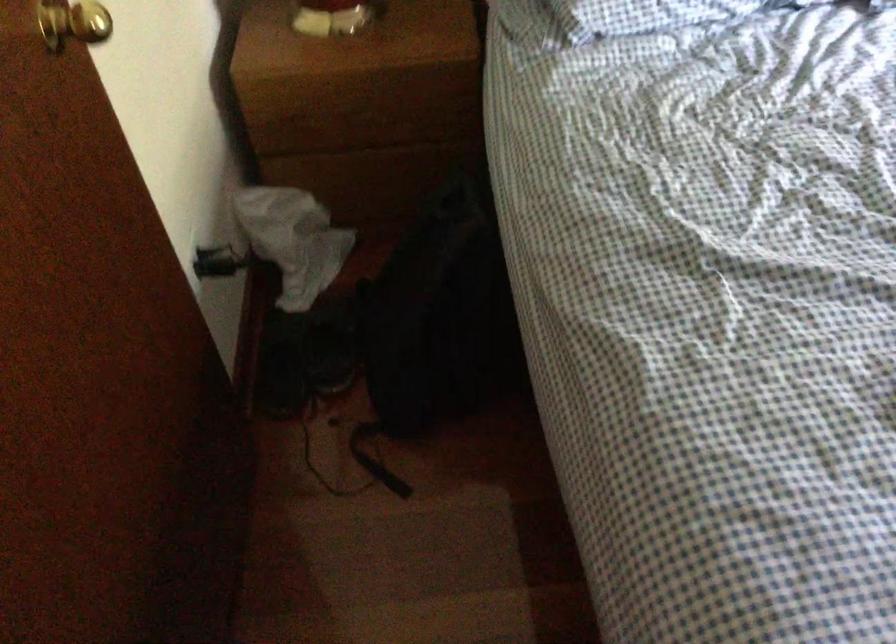
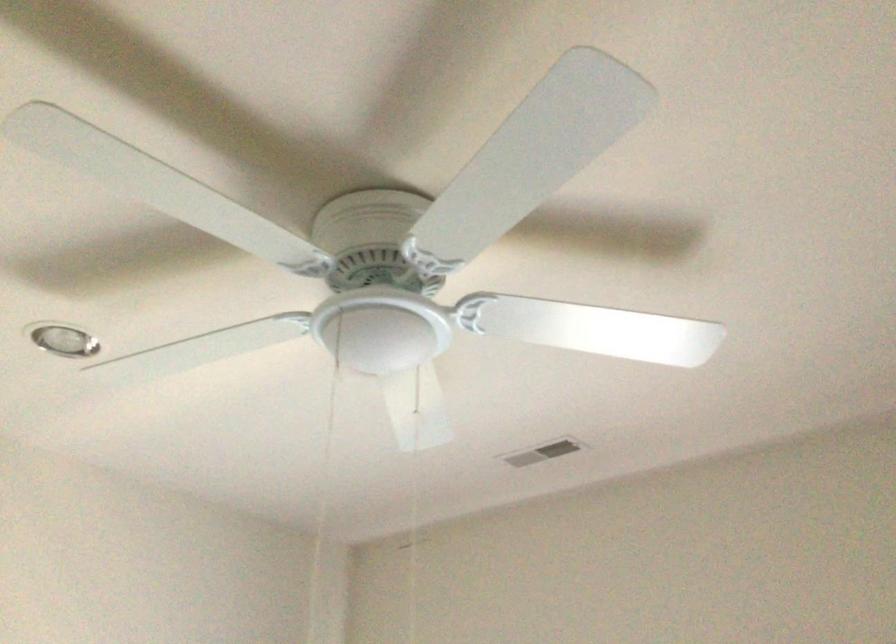
Based on the continuous images, in which direction is the camera rotating?

The rotation direction of the camera is right-up.